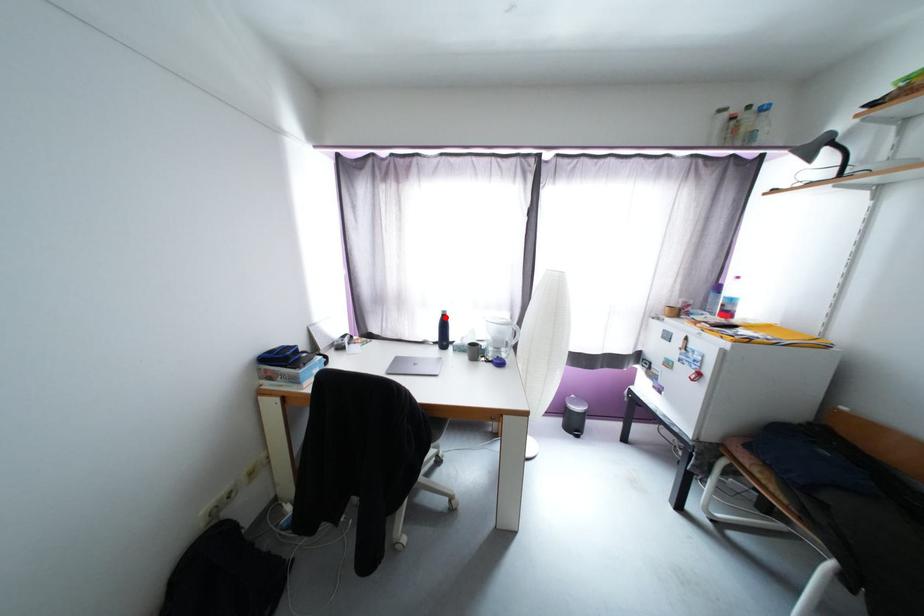
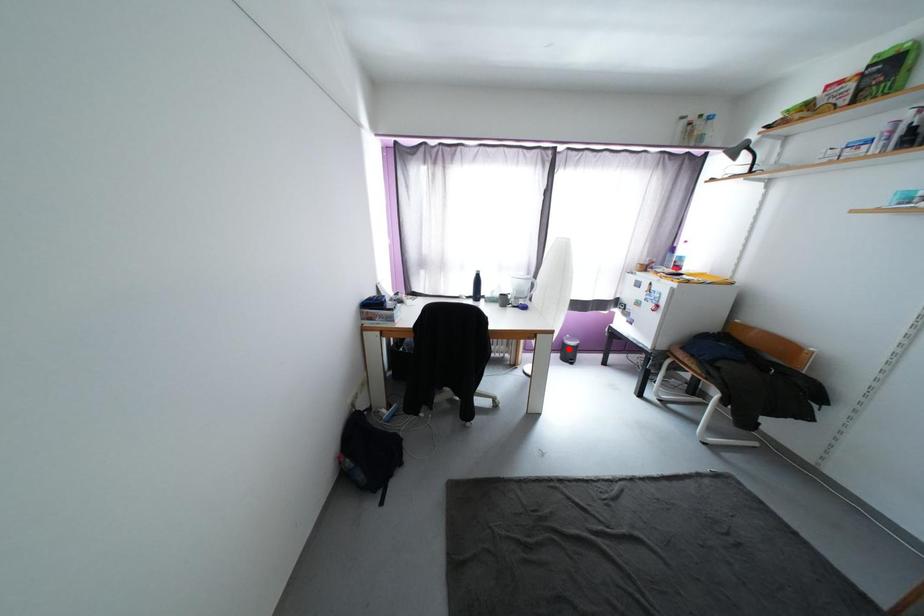
I am providing you with two images of the same scene from different viewpoints. A red point is marked on the first image and another point is marked on the second image. Are the points marked in image1 and image2 representing the same 3D position?

No